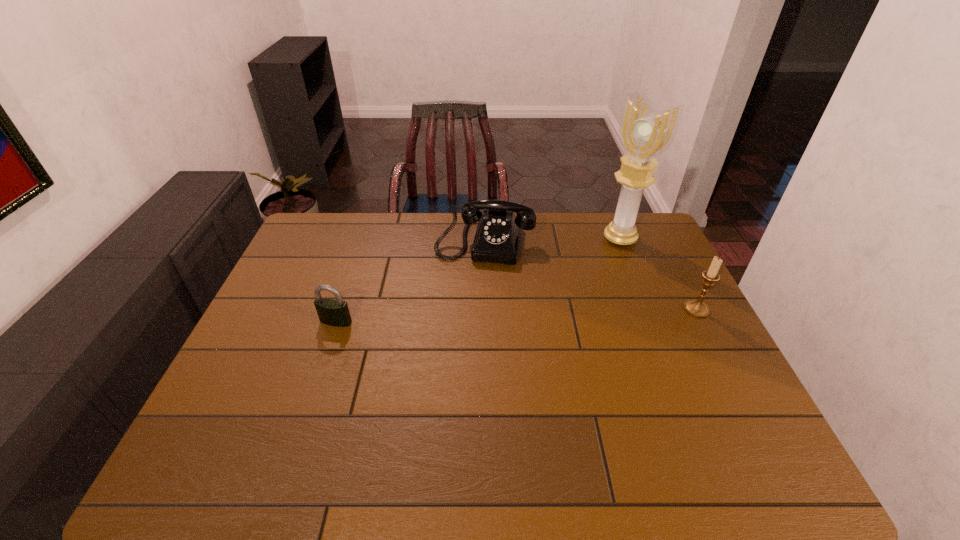
I want to click on blank area located 0.290m on the front-facing side of the award, so click(x=553, y=286).

Identify the location of vacant area situated 0.110m on the front-facing side of the award. (588, 261).

I want to click on free space located 0.170m on the dial of the third tallest object, so click(x=469, y=303).

This screenshot has width=960, height=540. I want to click on vacant space located on the dial of the third tallest object, so click(462, 335).

The image size is (960, 540). In order to click on vacant position located on the dial of the third tallest object in this screenshot , I will do `click(470, 298)`.

This screenshot has height=540, width=960. Identify the location of award that is positioned at the far edge. (644, 134).

Identify the location of telephone that is at the far edge. Image resolution: width=960 pixels, height=540 pixels. (496, 240).

Locate an element on the screen. The width and height of the screenshot is (960, 540). candle holder situated at the right edge is located at coordinates (697, 308).

Identify the location of award located at the right edge. This screenshot has width=960, height=540. (644, 134).

At what (x,y) coordinates should I click in order to perform the action: click on object positioned at the far right corner. Please return your answer as a coordinate pair (x, y). This screenshot has height=540, width=960. Looking at the image, I should click on (644, 134).